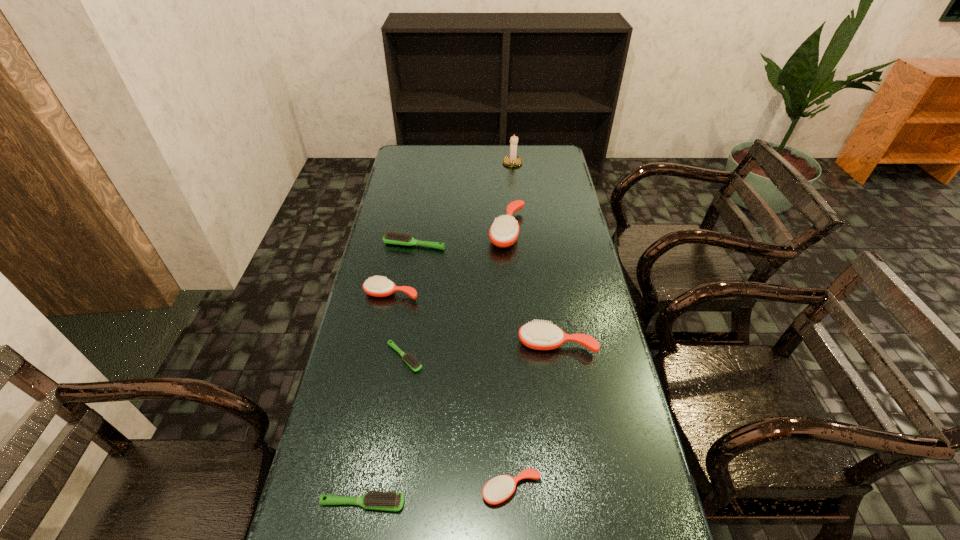
Locate which hairbrush ranks fourth in proximity to the farthest light hairbrush. Please provide its 2D coordinates. Your answer should be formatted as a tuple, i.e. [(x, y)], where the tuple contains the x and y coordinates of a point satisfying the conditions above.

[(537, 335)]

Identify the location of orange hairbrush that is the third closest to the white candle holder. The image size is (960, 540). (537, 335).

Select which orange hairbrush is the third closest to the second nearest orange hairbrush. Please provide its 2D coordinates. Your answer should be formatted as a tuple, i.e. [(x, y)], where the tuple contains the x and y coordinates of a point satisfying the conditions above.

[(504, 231)]

This screenshot has width=960, height=540. What are the coordinates of `light hairbrush that is the third closest to the tallest object` in the screenshot? It's located at (389, 501).

Select which light hairbrush appears as the second closest to the second nearest orange hairbrush. Please provide its 2D coordinates. Your answer should be formatted as a tuple, i.e. [(x, y)], where the tuple contains the x and y coordinates of a point satisfying the conditions above.

[(392, 237)]

What are the coordinates of `vacant space that satisfies the following two spatial constraints: 1. on the back side of the smallest orange hairbrush; 2. on the left side of the farthest orange hairbrush` in the screenshot? It's located at (498, 231).